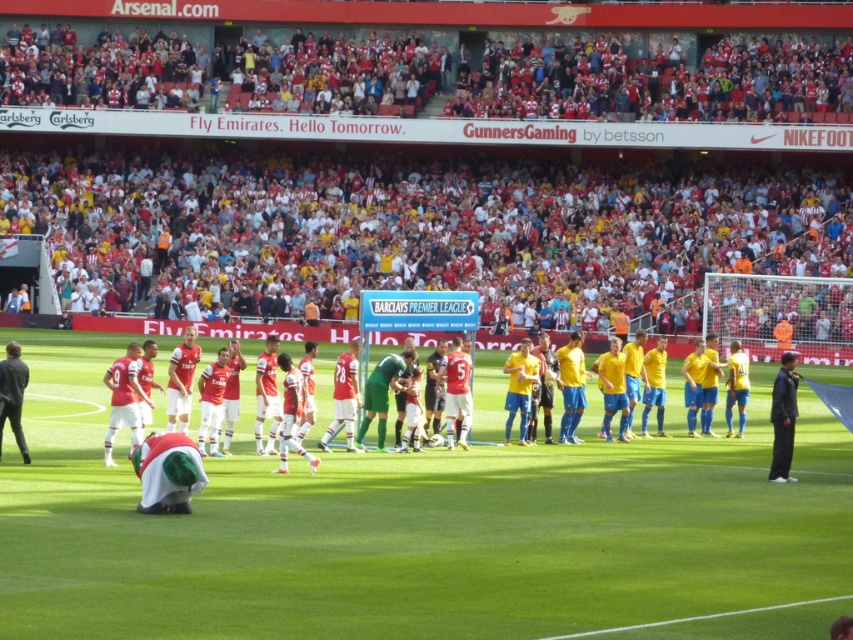
In the scene shown: You are a photographer standing at the edge of the field. You want to take a photo of the dark gray jacket at right and the green grass field at center. Which object should be placed on the left side of the photo?

The green grass field at center should be placed on the left side of the photo because it is to the left of the dark gray jacket at right according to the description.